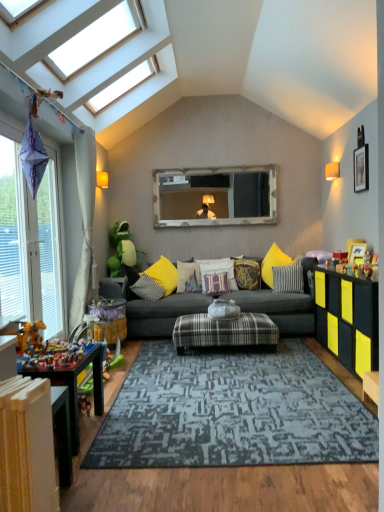
Question: Is white painted wood radiator at lower left in front of or behind wooden toy at lower left, acting as the 2th table starting from the back, in the image?

Choices:
 (A) behind
 (B) front

Answer: (B)

Question: Is white painted wood radiator at lower left wider or thinner than wooden toy at lower left, which is the 2th table in top-to-bottom order?

Choices:
 (A) wide
 (B) thin

Answer: (A)

Question: Considering the real-world distances, which object is closest to the white cotton pillow at center, the 3th pillow in the right-to-left sequence?

Choices:
 (A) black matte picture frame at upper right, the 1th picture frame viewed from the right
 (B) wooden frame mirror at center
 (C) multicolored plastic toys at lower left, the 2th toy from the top
 (D) yellow matte cabinet at right
 (E) matte yellow wall sconce at upper right, the 1th lamp viewed from the left

Answer: (B)

Question: Based on their relative distances, which object is nearer to the multicolored plastic toys at lower left, which is the first toy from bottom to top?

Choices:
 (A) transparent glass skylight at upper center, the 1th window from the top
 (B) beige fabric curtain at left
 (C) matte yellow wall sconce at upper right, the 1th lamp viewed from the left
 (D) wooden table at lower left, which appears as the 1th table when viewed from the front
 (E) gold textured pillow at center, the fifth pillow viewed from the left

Answer: (D)